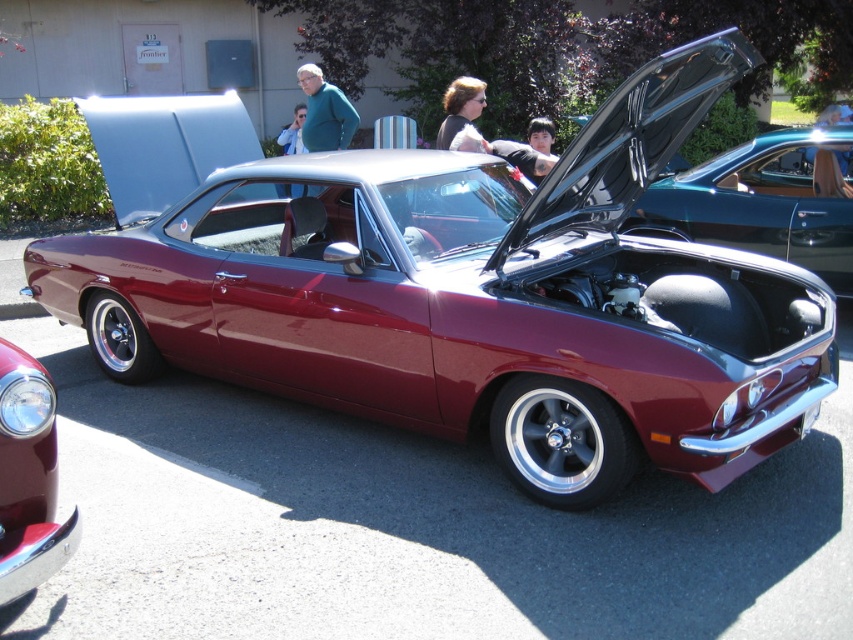
In the scene shown: Can you confirm if glossy chrome headlight at lower left is wider than dark brown hair at center?

Correct, the width of glossy chrome headlight at lower left exceeds that of dark brown hair at center.

Can you confirm if glossy chrome headlight at lower left is taller than dark brown hair at center?

Correct, glossy chrome headlight at lower left is much taller as dark brown hair at center.

Describe the element at coordinates (28, 477) in the screenshot. I see `glossy chrome headlight at lower left` at that location.

Locate an element on the screen. glossy chrome headlight at lower left is located at coordinates pyautogui.click(x=28, y=477).

Who is shorter, shiny teal car at center or dark brown hair at center?

dark brown hair at center is shorter.

Does shiny teal car at center have a lesser height compared to dark brown hair at center?

Incorrect, shiny teal car at center's height does not fall short of dark brown hair at center's.

At what (x,y) coordinates should I click in order to perform the action: click on shiny teal car at center. Please return your answer as a coordinate pair (x, y). This screenshot has height=640, width=853. Looking at the image, I should click on (761, 202).

Does point (782, 227) come in front of point (22, 460)?

No, (782, 227) is further to viewer.

Measure the distance between point (672, 205) and camera.

Point (672, 205) and camera are 6.78 meters apart.

Locate an element on the screen. The image size is (853, 640). shiny teal car at center is located at coordinates (761, 202).

Image resolution: width=853 pixels, height=640 pixels. In order to click on shiny teal car at center in this screenshot , I will do `click(761, 202)`.